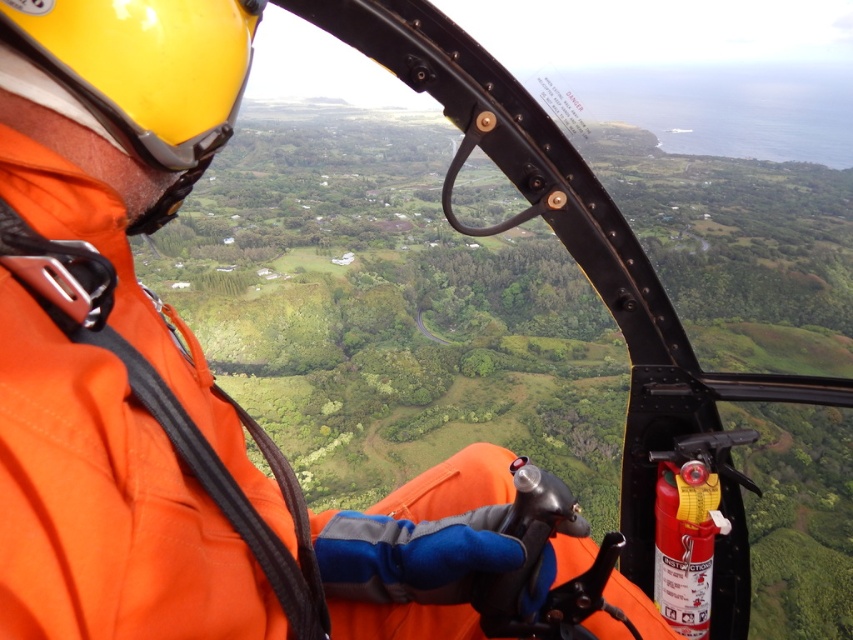
You are a passenger in the helicopter and want to put your backpack between the orange fabric jacket at center and the yellow matte helmet at upper left. Is this possible?

The orange fabric jacket at center is positioned under the yellow matte helmet at upper left, so there is space between them for placing the backpack.

Consider the image. You are a passenger sitting in the helicopter and need to locate the fire extinguisher. The pilot is wearing an orange fabric jacket at center and a yellow matte helmet at upper left. Which object is positioned to the right of the other?

The orange fabric jacket at center is to the right of yellow matte helmet at upper left.